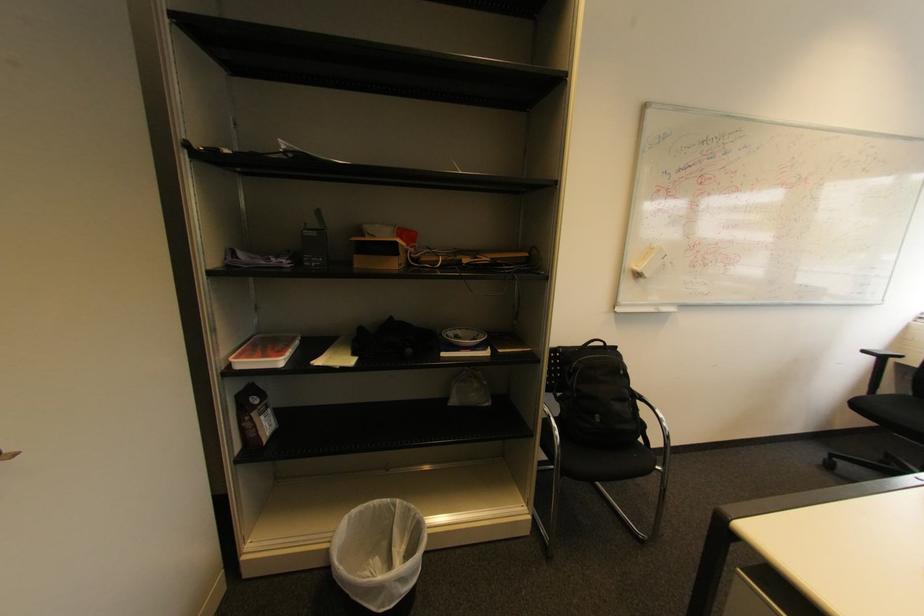
Where would you lift the black backpack? Please return your answer as a coordinate pair (x, y).

(594, 395)